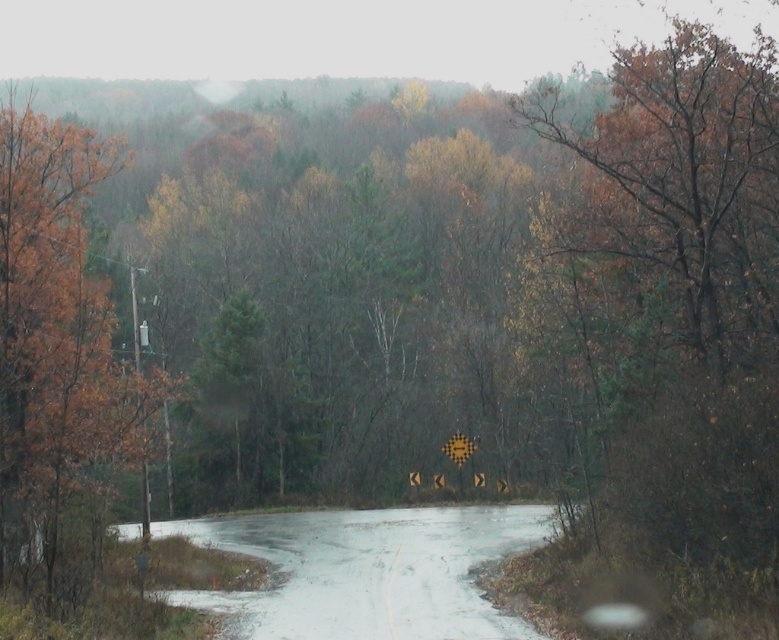
Is orange-brown bark tree at left above white matte flood at center?

Correct, orange-brown bark tree at left is located above white matte flood at center.

Is point (65, 195) behind point (509, 525)?

No, it is in front of (509, 525).

The height and width of the screenshot is (640, 779). I want to click on orange-brown bark tree at left, so click(x=58, y=360).